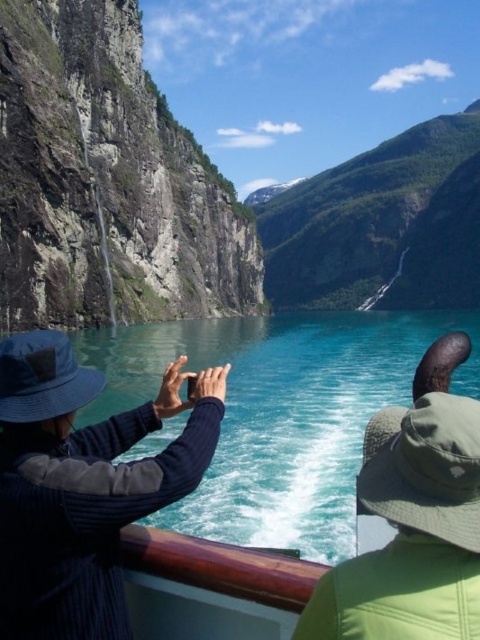
Which is above, wooden boat at center or green fabric hat at upper right?

wooden boat at center is above.

Who is positioned more to the left, wooden boat at center or green fabric hat at upper right?

wooden boat at center

This screenshot has height=640, width=480. In order to click on wooden boat at center in this screenshot , I will do `click(90, 508)`.

In order to click on wooden boat at center in this screenshot , I will do click(90, 508).

This screenshot has width=480, height=640. What do you see at coordinates (107, 180) in the screenshot? I see `rugged stone cliff at left` at bounding box center [107, 180].

Does rugged stone cliff at left appear on the right side of wooden boat at center?

No, rugged stone cliff at left is not to the right of wooden boat at center.

Is point (141, 129) positioned before point (60, 541)?

That is False.

Identify the location of rugged stone cliff at left. (107, 180).

Is rugged stone cliff at left closer to camera compared to green fabric hat at upper right?

No, it is behind green fabric hat at upper right.

The height and width of the screenshot is (640, 480). What do you see at coordinates (107, 180) in the screenshot?
I see `rugged stone cliff at left` at bounding box center [107, 180].

At what (x,y) coordinates should I click in order to perform the action: click on rugged stone cliff at left. Please return your answer as a coordinate pair (x, y). The image size is (480, 640). Looking at the image, I should click on (107, 180).

Locate an element on the screen. Image resolution: width=480 pixels, height=640 pixels. rugged stone cliff at left is located at coordinates (107, 180).